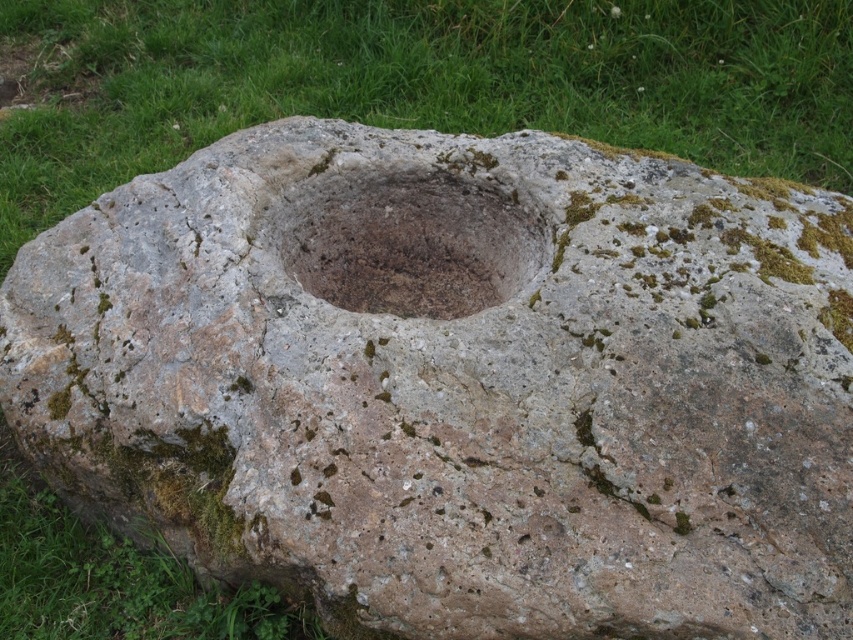
Question: Which point is closer to the camera?

Choices:
 (A) (390, 67)
 (B) (471, 296)

Answer: (B)

Question: Which point appears farthest from the camera in this image?

Choices:
 (A) (782, 3)
 (B) (297, 262)

Answer: (A)

Question: Can you confirm if green grass at upper center is positioned below brown stone hole at center?

Choices:
 (A) yes
 (B) no

Answer: (B)

Question: Observing the image, what is the correct spatial positioning of green grass at upper center in reference to brown stone hole at center?

Choices:
 (A) right
 (B) left

Answer: (B)

Question: Which object appears closest to the camera in this image?

Choices:
 (A) brown stone hole at center
 (B) green grass at upper center

Answer: (A)

Question: Considering the relative positions of green grass at upper center and brown stone hole at center in the image provided, where is green grass at upper center located with respect to brown stone hole at center?

Choices:
 (A) above
 (B) below

Answer: (A)